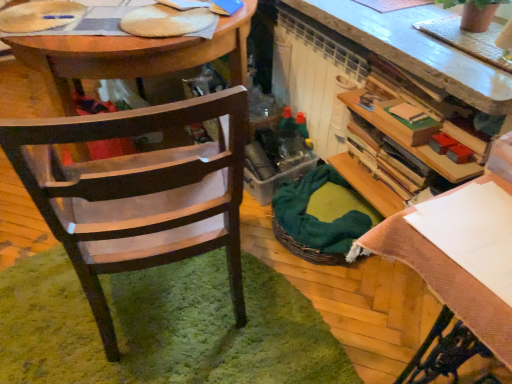
This screenshot has width=512, height=384. In order to click on empty space that is in between white paper at upper right and green woven picnic basket at center in this screenshot , I will do `click(359, 296)`.